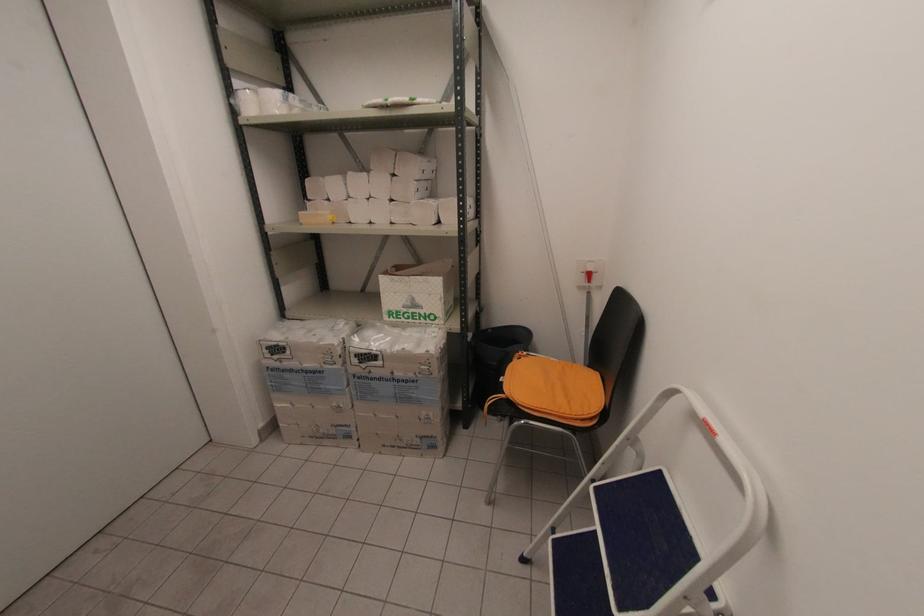
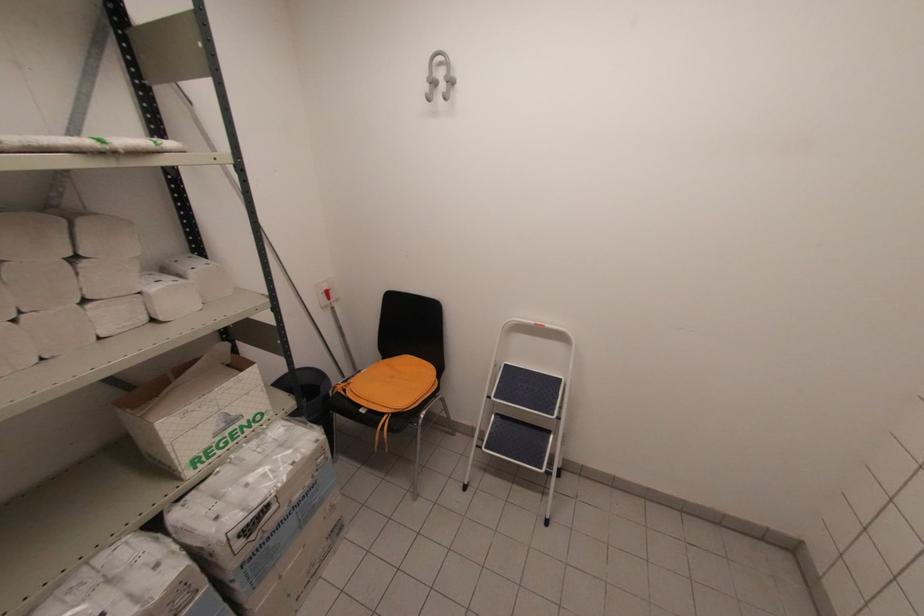
Where in the second image is the point corresponding to the point at 590,282 from the first image?

(330, 299)